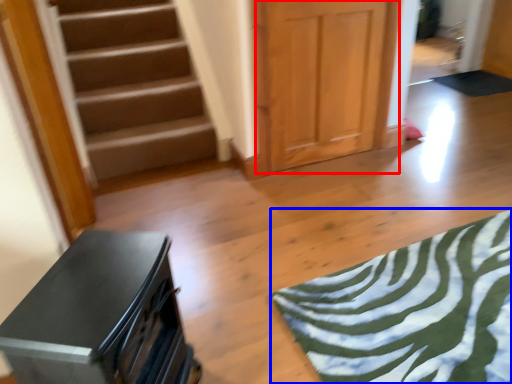
Question: Which of the following is the farthest to the observer, door (highlighted by a red box) or yoga mat (highlighted by a blue box)?

Choices:
 (A) door
 (B) yoga mat

Answer: (A)